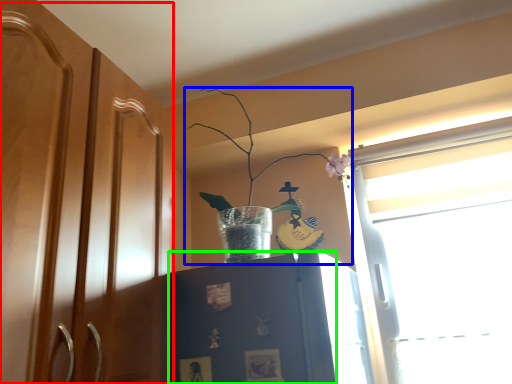
Question: Based on their relative distances, which object is farther from dresser (highlighted by a red box)? Choose from houseplant (highlighted by a blue box) and cabinetry (highlighted by a green box).

Choices:
 (A) houseplant
 (B) cabinetry

Answer: (A)